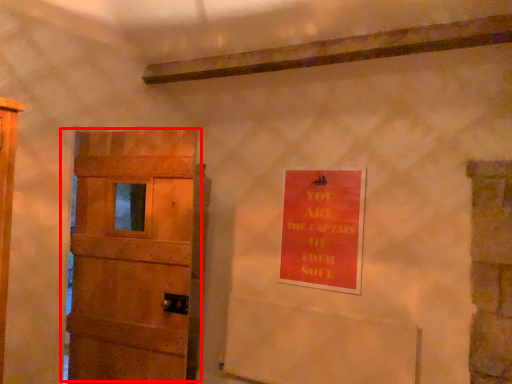
Question: From the image's perspective, considering the relative positions of door (annotated by the red box) and warning sign in the image provided, where is door (annotated by the red box) located with respect to the staircase?

Choices:
 (A) below
 (B) above

Answer: (A)